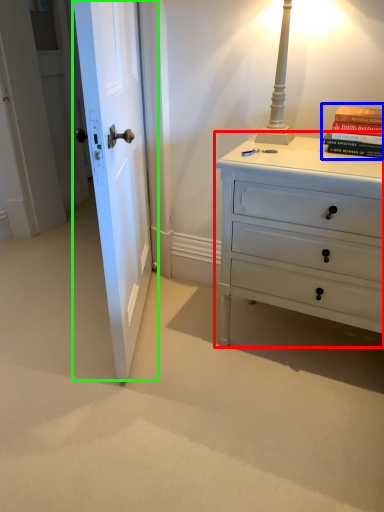
Question: Based on their relative distances, which object is farther from chest of drawers (highlighted by a red box)? Choose from paperback book (highlighted by a blue box) and door (highlighted by a green box).

Choices:
 (A) paperback book
 (B) door

Answer: (B)